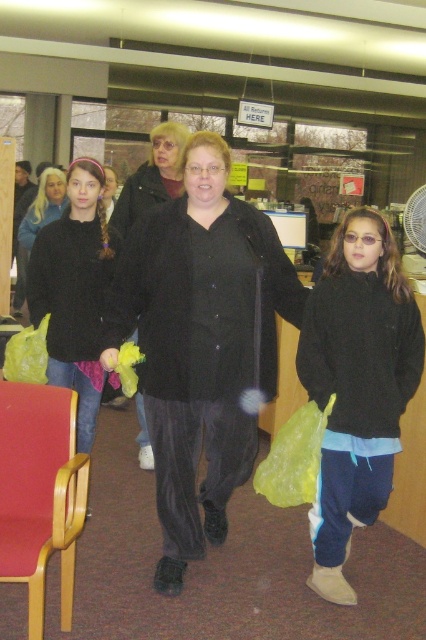
You are standing in the library and want to place a small potted plant exactly at the point marked as point (x=224, y=273). If you are currently 7.77 feet away from that point, how many steps would you need to take to reach it, assuming each step covers about 2.5 feet?

Since the distance to point (x=224, y=273) is 7.77 feet and each step covers 2.5 feet, you would need approximately 3 steps to reach it.

You are a photographer trying to capture a candid shot of the black fuzzy sweater at center and the matte black coat at center. Since both are moving, you need to focus on the one that is closer to the camera. Which one should you focus on?

The black fuzzy sweater at center is in front of the matte black coat at center, so you should focus on the black fuzzy sweater at center as it is closer to the camera.